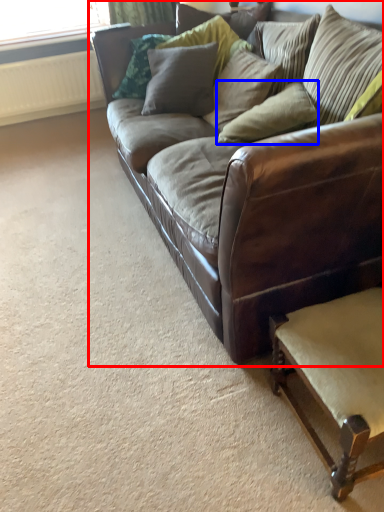
Question: Which object is further to the camera taking this photo, studio couch (highlighted by a red box) or pillow (highlighted by a blue box)?

Choices:
 (A) studio couch
 (B) pillow

Answer: (B)